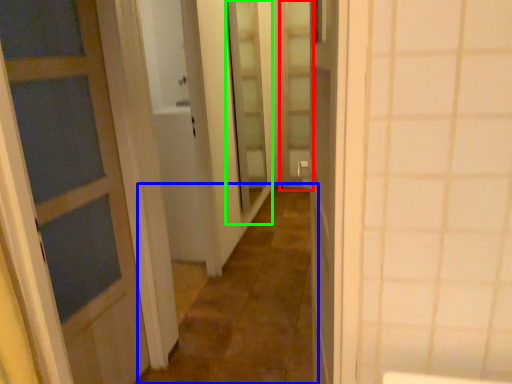
Question: Estimate the real-world distances between objects in this image. Which object is farther from screen door (highlighted by a red box), alley (highlighted by a blue box) or screen door (highlighted by a green box)?

Choices:
 (A) alley
 (B) screen door

Answer: (A)